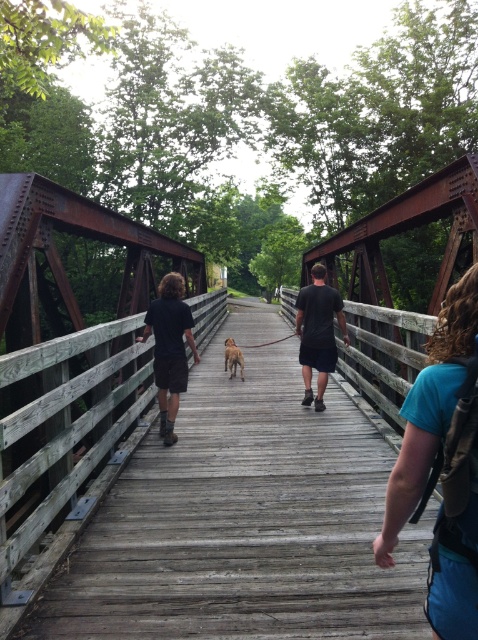
You are standing on the wooden bridge and want to walk towards the point that is closer to you. Which point should you head towards, point (280,416) or point (286,337)?

You should head towards point (280,416) because it is closer to the viewer than point (286,337).

You are standing at the point with coordinates point (281, 339) and want to walk towards the point with coordinates point (156, 365). Based on the scene description, which direction should you move relative to your current position?

You should move forward because point (156, 365) is in front of point (281, 339), so moving forward from your current position will lead you towards the desired point.

From the picture: You are a delivery robot with a width of 1.5 meters. You need to cross the wooden bridge and pass between the dark blue shirt at center and the black matte shorts at center. Can you fit through the space between them without touching either?

The dark blue shirt at center and black matte shorts at center are 2.10 meters apart from each other. Since the robot is 1.5 meters wide, it can fit through the space between them as the gap is wider than the robot.